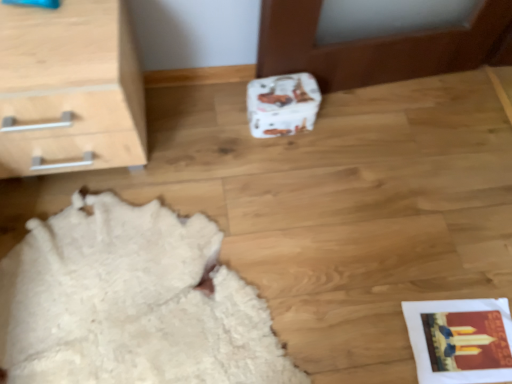
Find the location of a particular element. This screenshot has width=512, height=384. blank space above light wood/texture chest of drawers at upper left (from a real-world perspective) is located at coordinates (46, 38).